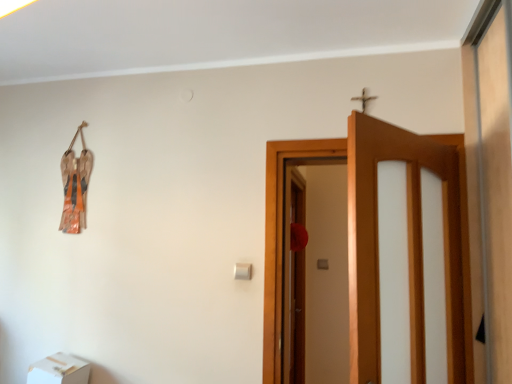
Question: Would you say white cardboard box at lower left is to the left or to the right of wooden door at center in the picture?

Choices:
 (A) left
 (B) right

Answer: (A)

Question: In terms of size, does white cardboard box at lower left appear bigger or smaller than wooden door at center?

Choices:
 (A) big
 (B) small

Answer: (B)

Question: Is white cardboard box at lower left wider or thinner than wooden door at center?

Choices:
 (A) thin
 (B) wide

Answer: (A)

Question: Relative to white cardboard box at lower left, is wooden door at center in front or behind?

Choices:
 (A) behind
 (B) front

Answer: (B)

Question: Based on their positions, is wooden door at center located to the left or right of white cardboard box at lower left?

Choices:
 (A) right
 (B) left

Answer: (A)

Question: Based on their sizes in the image, would you say wooden door at center is bigger or smaller than white cardboard box at lower left?

Choices:
 (A) small
 (B) big

Answer: (B)

Question: Considering the positions of point (459, 208) and point (36, 379), is point (459, 208) closer or farther from the camera than point (36, 379)?

Choices:
 (A) farther
 (B) closer

Answer: (B)